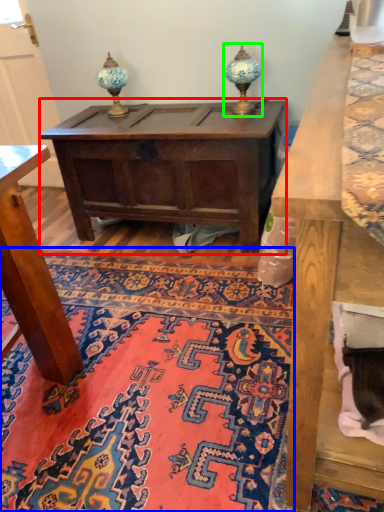
Question: Which is farther away from table (highlighted by a red box)? mat (highlighted by a blue box) or table lamp (highlighted by a green box)?

Choices:
 (A) mat
 (B) table lamp

Answer: (A)